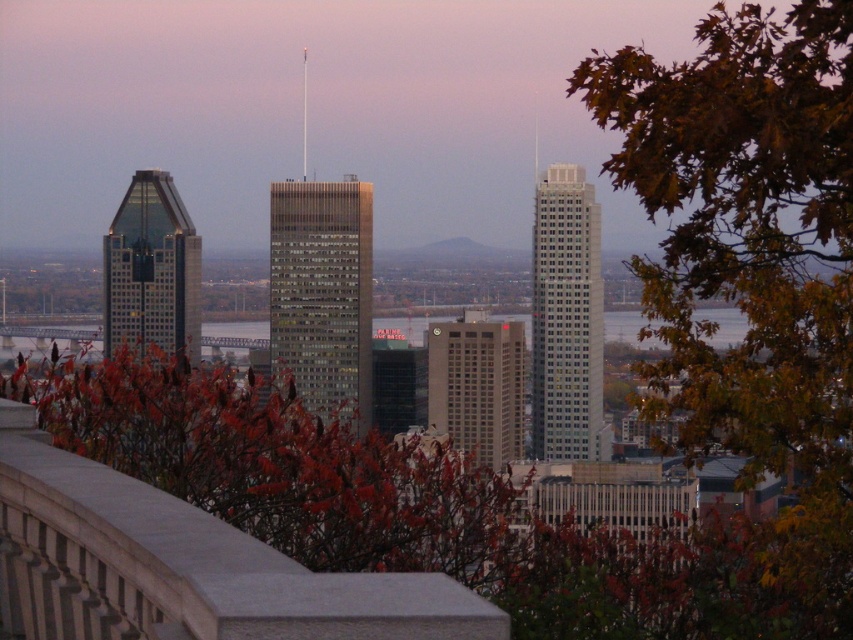
In the scene shown: Does glassy gray skyscraper at center have a lesser height compared to beige concrete building at center?

No.

Does glassy gray skyscraper at center have a lesser width compared to beige concrete building at center?

In fact, glassy gray skyscraper at center might be wider than beige concrete building at center.

Does point (320, 220) come farther from viewer compared to point (445, 390)?

That is True.

Locate an element on the screen. This screenshot has height=640, width=853. glassy gray skyscraper at center is located at coordinates (322, 294).

Is sleek silver skyscraper at center smaller than beige concrete building at center?

No, sleek silver skyscraper at center is not smaller than beige concrete building at center.

Is point (579, 396) in front of point (498, 436)?

No, it is behind (498, 436).

You are a GUI agent. You are given a task and a screenshot of the screen. Output one action in this format:
    pyautogui.click(x=<x>, y=<y>)
    Task: Click on the sleek silver skyscraper at center
    The image size is (853, 640).
    Given the screenshot: What is the action you would take?
    pyautogui.click(x=566, y=320)

Between brown leafy tree at upper right and glassy reflective skyscraper at left, which one is positioned higher?

glassy reflective skyscraper at left is above.

Based on the photo, is brown leafy tree at upper right smaller than glassy reflective skyscraper at left?

Actually, brown leafy tree at upper right might be larger than glassy reflective skyscraper at left.

Image resolution: width=853 pixels, height=640 pixels. I want to click on brown leafy tree at upper right, so click(x=753, y=260).

This screenshot has height=640, width=853. Identify the location of brown leafy tree at upper right. (753, 260).